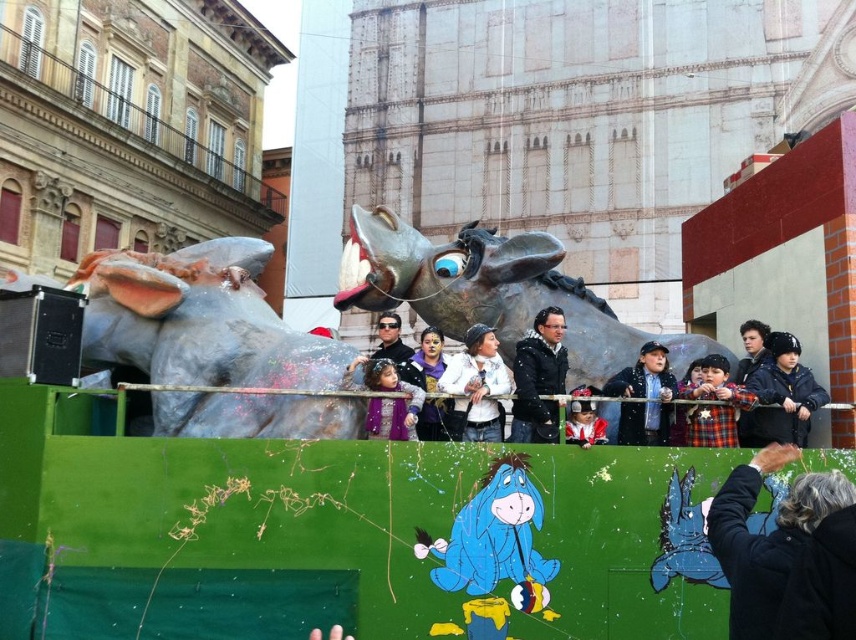
Question: From the image, what is the correct spatial relationship of black matte jacket at center in relation to blue denim jacket at center?

Choices:
 (A) right
 (B) left

Answer: (B)

Question: Is gray metallic bull at left above plaid fabric child at center?

Choices:
 (A) yes
 (B) no

Answer: (A)

Question: Which object is the closest to the smooth black hair at upper right?

Choices:
 (A) bronze statue at center
 (B) white matte jacket at center
 (C) matte blue hat at center

Answer: (A)

Question: Is bronze statue at center to the right of dark gray sweater at center from the viewer's perspective?

Choices:
 (A) yes
 (B) no

Answer: (B)

Question: Considering the real-world distances, which object is closest to the black leather jacket at right?

Choices:
 (A) white matte jacket at center
 (B) smooth black hair at upper right

Answer: (B)

Question: Based on their relative distances, which object is farther from the matte blue hat at center?

Choices:
 (A) plaid fabric child at center
 (B) dark gray sweater at center
 (C) gray metallic bull at left

Answer: (C)